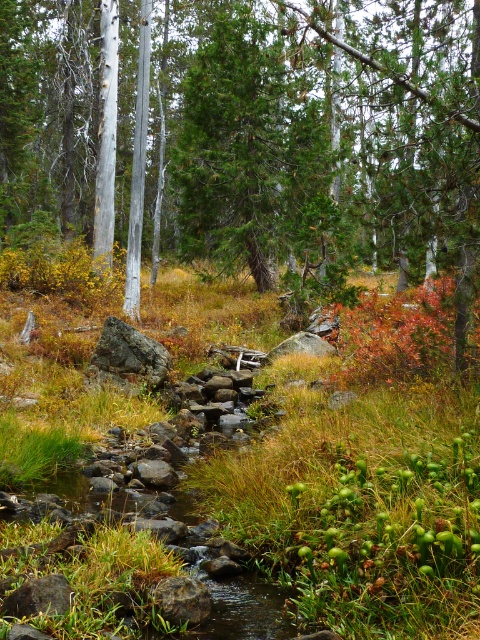
Question: Which is farther from the green grass at center?

Choices:
 (A) gray rock at center
 (B) green textured tree at center

Answer: (B)

Question: Which object is positioned farthest from the green textured tree at center?

Choices:
 (A) gray rock at center
 (B) green grass at center

Answer: (A)

Question: Does green textured tree at center lie behind gray rock at center?

Choices:
 (A) yes
 (B) no

Answer: (B)

Question: Is green textured tree at center to the left of gray rock at center from the viewer's perspective?

Choices:
 (A) yes
 (B) no

Answer: (A)

Question: Does green grass at center appear under gray rock at center?

Choices:
 (A) yes
 (B) no

Answer: (A)

Question: Estimate the real-world distances between objects in this image. Which object is closer to the green textured tree at center?

Choices:
 (A) green grass at center
 (B) gray rock at center

Answer: (A)